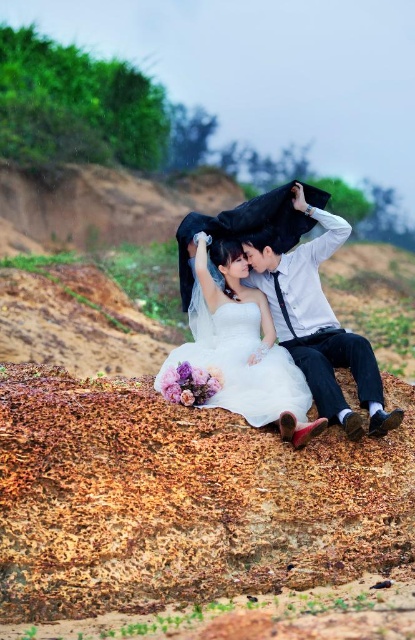
Question: Which point is farther to the camera?

Choices:
 (A) white satin shirt at center
 (B) white satin dress at center

Answer: (A)

Question: Among these points, which one is nearest to the camera?

Choices:
 (A) (214, 317)
 (B) (309, 211)

Answer: (A)

Question: From the image, what is the correct spatial relationship of white satin shirt at center in relation to white satin dress at center?

Choices:
 (A) right
 (B) left

Answer: (A)

Question: Which point appears closest to the camera in this image?

Choices:
 (A) (312, 388)
 (B) (207, 362)

Answer: (A)

Question: Does white satin shirt at center have a larger size compared to white satin dress at center?

Choices:
 (A) no
 (B) yes

Answer: (B)

Question: Does white satin shirt at center appear over white satin dress at center?

Choices:
 (A) no
 (B) yes

Answer: (B)